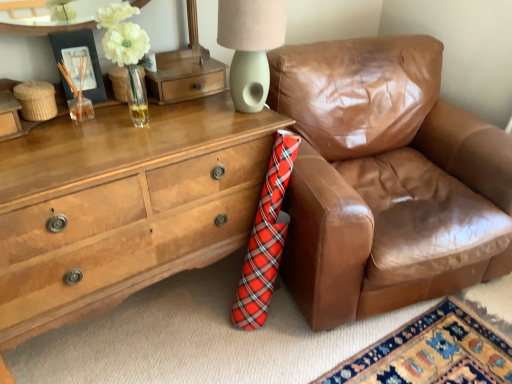
Question: Considering the relative positions of matte black picture frame at upper left and matte green ceramic lampshade at upper center in the image provided, is matte black picture frame at upper left behind matte green ceramic lampshade at upper center?

Choices:
 (A) yes
 (B) no

Answer: (A)

Question: From the image's perspective, is matte black picture frame at upper left located above matte green ceramic lampshade at upper center?

Choices:
 (A) yes
 (B) no

Answer: (B)

Question: Is the position of matte black picture frame at upper left less distant than that of matte green ceramic lampshade at upper center?

Choices:
 (A) yes
 (B) no

Answer: (B)

Question: Is matte black picture frame at upper left to the right of matte green ceramic lampshade at upper center from the viewer's perspective?

Choices:
 (A) no
 (B) yes

Answer: (A)

Question: From the image's perspective, would you say matte black picture frame at upper left is shown under matte green ceramic lampshade at upper center?

Choices:
 (A) yes
 (B) no

Answer: (A)

Question: Does matte black picture frame at upper left turn towards matte green ceramic lampshade at upper center?

Choices:
 (A) no
 (B) yes

Answer: (A)

Question: Is matte green ceramic lampshade at upper center oriented away from matte black picture frame at upper left?

Choices:
 (A) no
 (B) yes

Answer: (A)

Question: Is matte green ceramic lampshade at upper center far from matte black picture frame at upper left?

Choices:
 (A) no
 (B) yes

Answer: (A)

Question: Considering the relative sizes of matte green ceramic lampshade at upper center and matte black picture frame at upper left in the image provided, is matte green ceramic lampshade at upper center shorter than matte black picture frame at upper left?

Choices:
 (A) yes
 (B) no

Answer: (B)

Question: From the image's perspective, is matte green ceramic lampshade at upper center beneath matte black picture frame at upper left?

Choices:
 (A) yes
 (B) no

Answer: (B)

Question: Does matte green ceramic lampshade at upper center come behind matte black picture frame at upper left?

Choices:
 (A) yes
 (B) no

Answer: (B)

Question: Considering the relative sizes of matte green ceramic lampshade at upper center and matte black picture frame at upper left in the image provided, is matte green ceramic lampshade at upper center taller than matte black picture frame at upper left?

Choices:
 (A) no
 (B) yes

Answer: (B)

Question: Could you tell me if matte black picture frame at upper left is turned towards wooden chest of drawers at lower left?

Choices:
 (A) yes
 (B) no

Answer: (B)